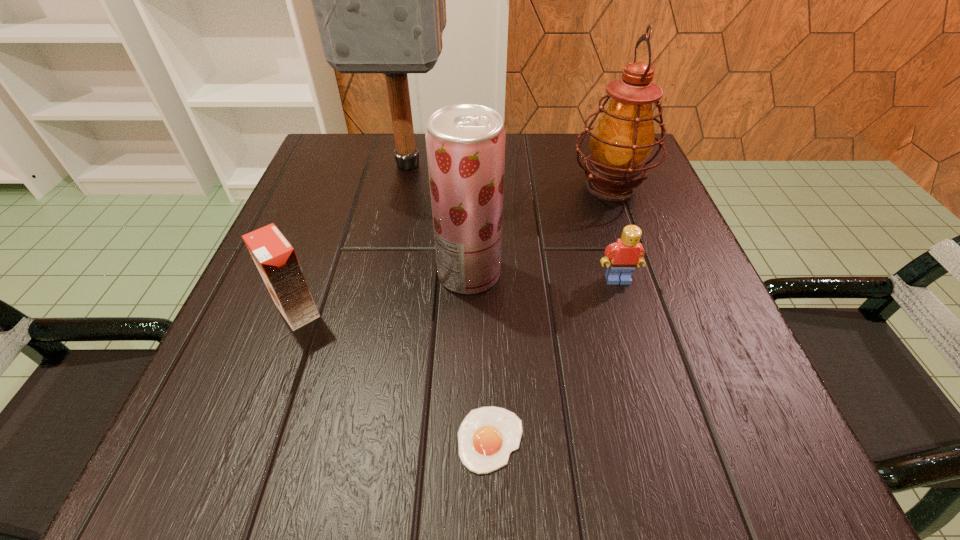
Find the location of `mallet`. mallet is located at coordinates (379, 0).

You are a GUI agent. You are given a task and a screenshot of the screen. Output one action in this format:
    pyautogui.click(x=<x>, y=<y>)
    Task: Click on the oil lamp
    The width and height of the screenshot is (960, 540).
    Given the screenshot: What is the action you would take?
    pyautogui.click(x=622, y=140)

What are the coordinates of `fruit juice` in the screenshot? It's located at (465, 142).

Find the location of a particular element. The image size is (960, 540). orange juice is located at coordinates (275, 258).

This screenshot has width=960, height=540. I want to click on Lego, so click(x=625, y=255).

You are a GUI agent. You are given a task and a screenshot of the screen. Output one action in this format:
    pyautogui.click(x=<x>, y=<y>)
    Task: Click on the shortest object
    Image resolution: width=960 pixels, height=540 pixels.
    Given the screenshot: What is the action you would take?
    pyautogui.click(x=487, y=435)

Locate an element on the screen. egg yolk is located at coordinates (487, 435).

The width and height of the screenshot is (960, 540). What are the coordinates of `free space located on the striking surface of the mallet` in the screenshot? It's located at (372, 338).

Find the location of a particular element. free location located on the left of the oil lamp is located at coordinates (497, 186).

At what (x,y) coordinates should I click in order to perform the action: click on free point located on the back of the fruit juice. Please return your answer as a coordinate pair (x, y). The image size is (960, 540). Looking at the image, I should click on (470, 218).